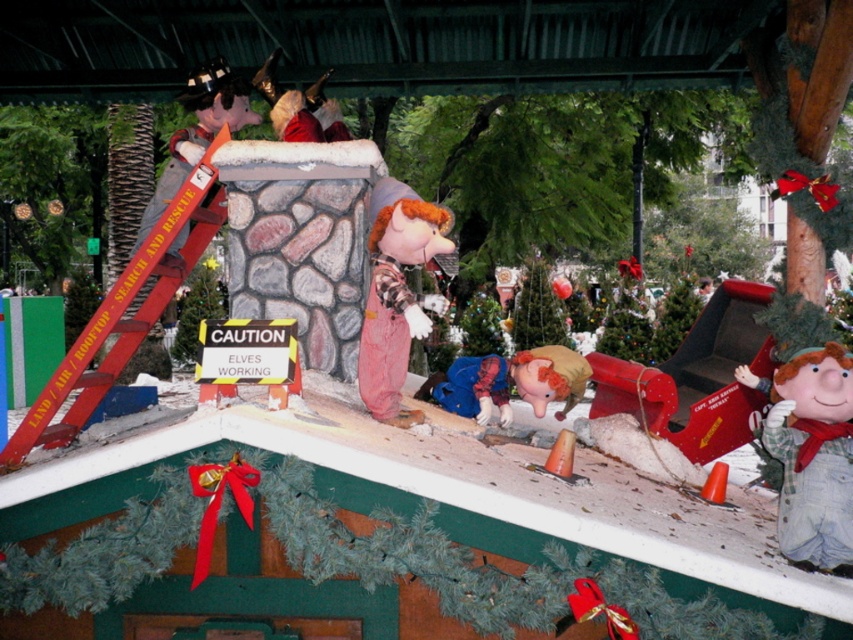
Is flannel shirt at lower right to the left of red metal ladder at upper left from the viewer's perspective?

Incorrect, flannel shirt at lower right is not on the left side of red metal ladder at upper left.

Find the location of a particular element. Image resolution: width=853 pixels, height=640 pixels. flannel shirt at lower right is located at coordinates (813, 456).

Which of these two, flannel shirt at lower right or flannel shirt overalls at center, stands shorter?

flannel shirt at lower right

Does point (846, 368) come closer to viewer compared to point (370, 348)?

Yes, point (846, 368) is closer to viewer.

The height and width of the screenshot is (640, 853). I want to click on flannel shirt at lower right, so click(813, 456).

Between red metal ladder at upper left and flannel shirt overalls at center, which one appears on the left side from the viewer's perspective?

red metal ladder at upper left is more to the left.

Who is higher up, red metal ladder at upper left or flannel shirt overalls at center?

flannel shirt overalls at center is higher up.

Locate an element on the screen. This screenshot has width=853, height=640. red metal ladder at upper left is located at coordinates (120, 316).

Where is `red metal ladder at upper left`? This screenshot has width=853, height=640. red metal ladder at upper left is located at coordinates (120, 316).